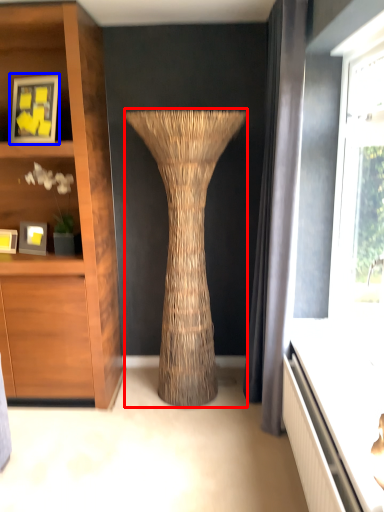
Question: Which of the following is the closest to the observer, vase (highlighted by a red box) or picture frame (highlighted by a blue box)?

Choices:
 (A) vase
 (B) picture frame

Answer: (A)